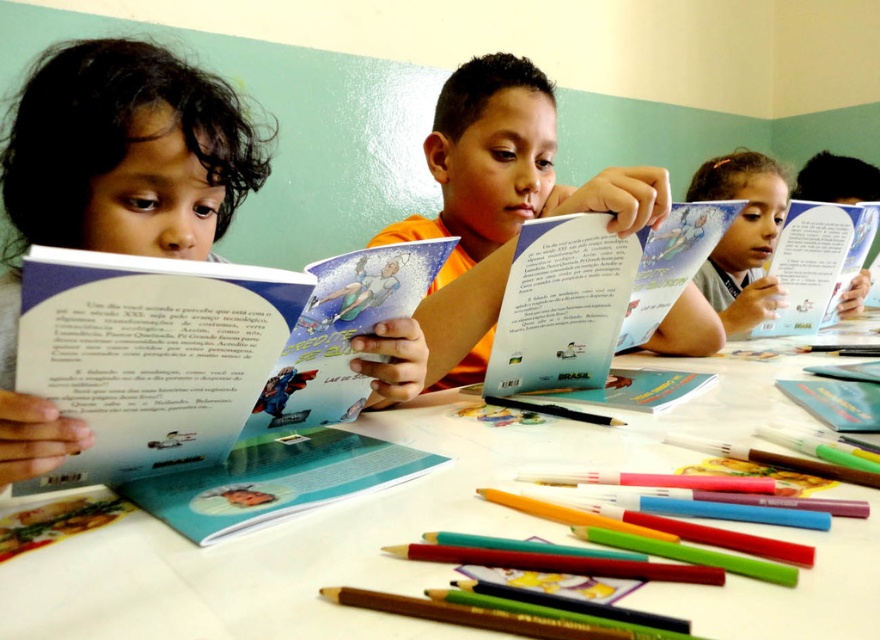
Which is more to the right, matte paper book at center or matte blue book at upper right?

matte blue book at upper right is more to the right.

Does matte paper book at center have a greater height compared to matte blue book at upper right?

Incorrect, matte paper book at center's height is not larger of matte blue book at upper right's.

Is point (202, 346) farther from camera compared to point (705, 198)?

No.

You are a GUI agent. You are given a task and a screenshot of the screen. Output one action in this format:
    pyautogui.click(x=<x>, y=<y>)
    Task: Click on the matte paper book at center
    
    Given the screenshot: What is the action you would take?
    pyautogui.click(x=200, y=349)

Which is in front, point (334, 467) or point (757, 326)?

Point (334, 467) is in front.

Is point (430, 454) farther from camera compared to point (827, 296)?

No, it is in front of (827, 296).

Which is behind, point (173, 476) or point (815, 268)?

Positioned behind is point (815, 268).

The height and width of the screenshot is (640, 880). Find the location of `matte blue book at center`. matte blue book at center is located at coordinates (274, 481).

Is point (82, 541) positioned after point (130, 477)?

No, it is in front of (130, 477).

Does white paper table at center have a smaller size compared to matte paper book at center?

No.

Which is in front, point (371, 531) or point (104, 474)?

Point (371, 531)

Identify the location of white paper table at center. This screenshot has height=640, width=880. pyautogui.click(x=360, y=525).